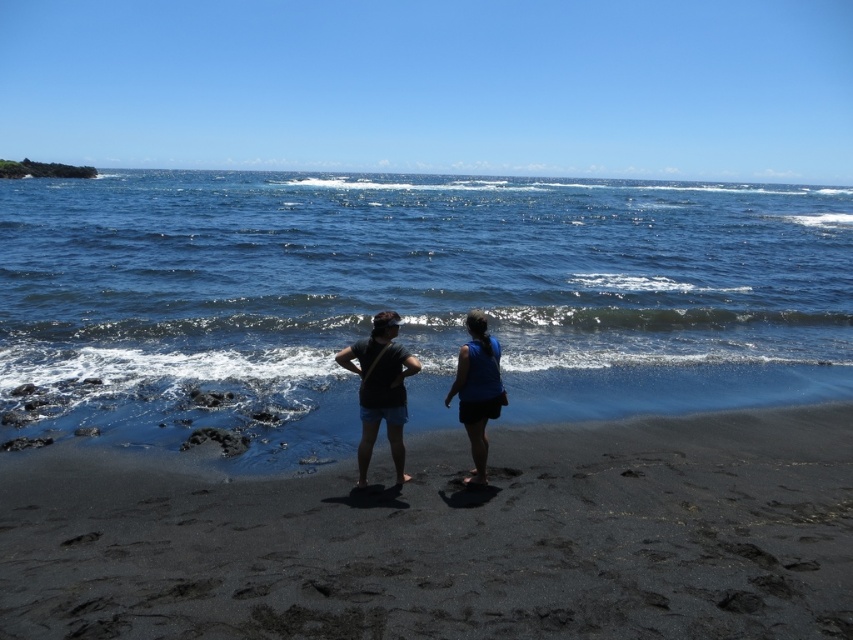
You are standing on the beach and see two points marked on the sand. The first point is at coordinates point (194,218) and the second point is at point (257,561). Which point is closer to you?

Point (194,218) is closer to you because it is further to the camera than point (257,561).

You are a photographer trying to capture the black sand at center and the blue fabric skirt at center in the same frame. Based on their positions, which object should you focus on first to ensure both are in focus?

The black sand at center is in front of the blue fabric skirt at center, so you should focus on the black sand at center first to ensure both are in focus.